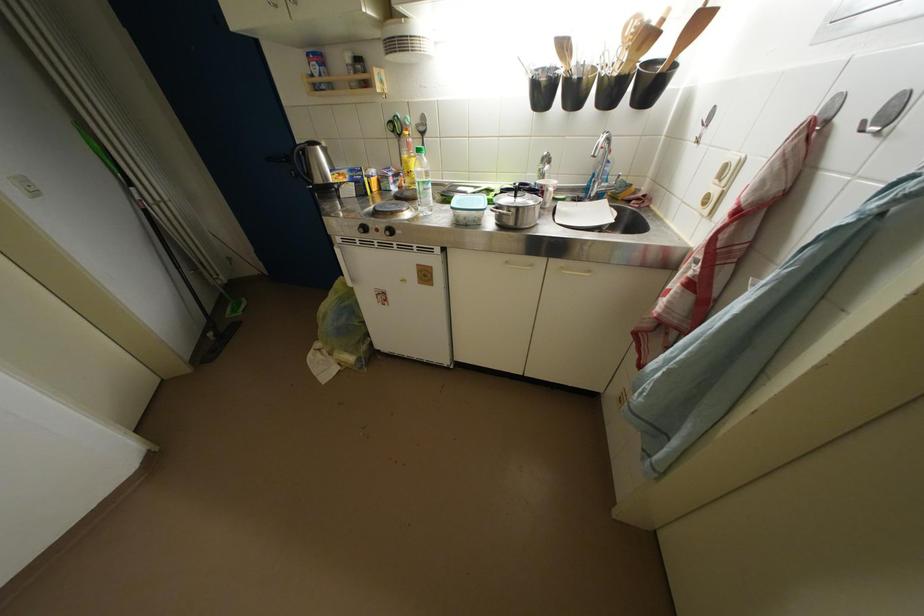
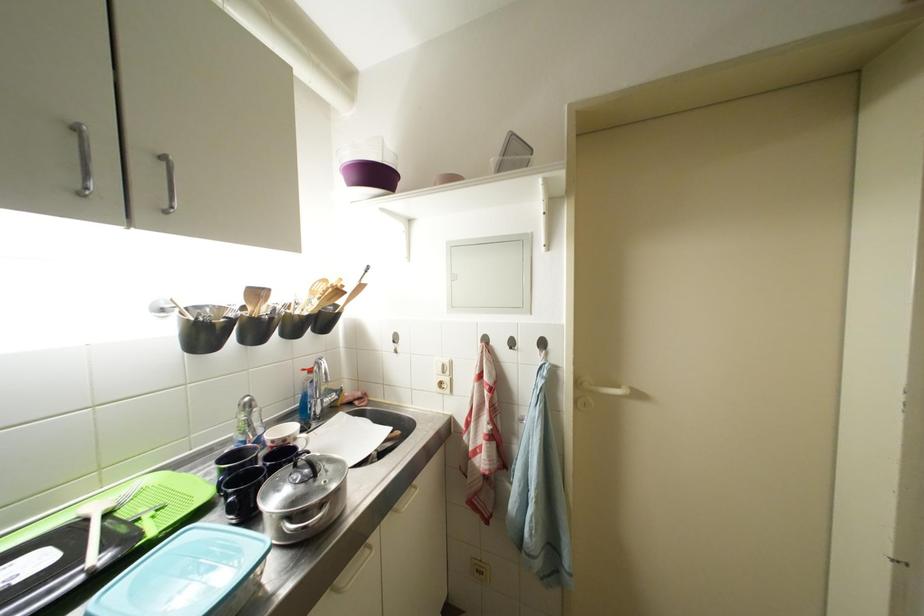
Question: Based on the continuous images, in which direction is the camera rotating? Reply with the corresponding letter.

Choices:
 (A) Left
 (B) Right
 (C) Up
 (D) Down

Answer: (B)